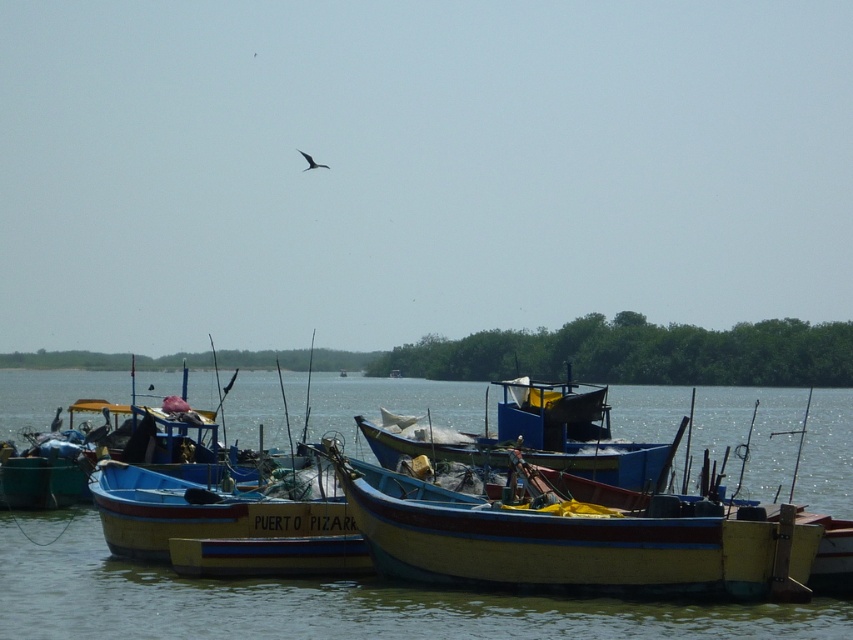
Which is behind, point (635, 460) or point (321, 166)?

Positioned behind is point (321, 166).

Can you confirm if blue painted wood boat at center is taller than dark gray feathered bird at upper center?

In fact, blue painted wood boat at center may be shorter than dark gray feathered bird at upper center.

The height and width of the screenshot is (640, 853). I want to click on blue painted wood boat at center, so click(538, 436).

Is wooden blue boat at center bigger than dark gray feathered bird at upper center?

No.

Which is in front, point (308, 552) or point (299, 150)?

Point (308, 552)

Where is `wooden blue boat at center`? This screenshot has width=853, height=640. wooden blue boat at center is located at coordinates (221, 528).

Can you confirm if smooth water at center is positioned to the right of blue painted wood boat at center?

Correct, you'll find smooth water at center to the right of blue painted wood boat at center.

Which is above, smooth water at center or blue painted wood boat at center?

Positioned higher is blue painted wood boat at center.

Looking at this image, who is more forward, (73, 380) or (550, 419)?

Point (550, 419) is more forward.

Where is `smooth water at center`? The height and width of the screenshot is (640, 853). smooth water at center is located at coordinates (326, 602).